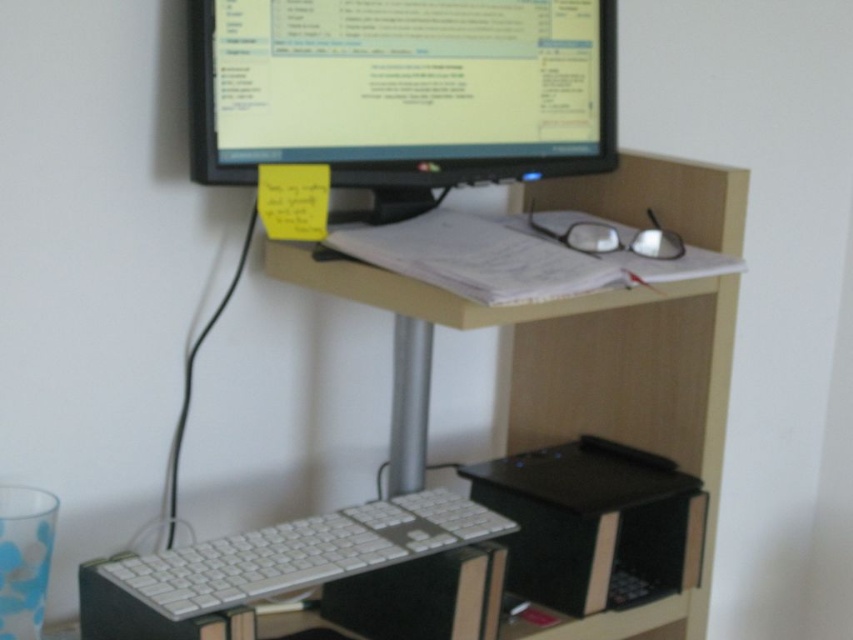
You are a photographer taking a picture of the workspace. You notice two points marked on the desk surface at coordinates point (314, 77) and point (363, 554). Which point is closer to the camera?

Point (314, 77) is further to the camera than point (363, 554), so the point closer to the camera is point (363, 554).

You are setting up a new workspace and need to place a lamp on the wooden computer desk at center. Based on the coordinates provided, where should you position the lamp to ensure it illuminates the entire desk surface?

The wooden computer desk at center is located at point (506, 433). To illuminate the entire desk surface, position the lamp near the center coordinates to ensure even lighting across the workspace.